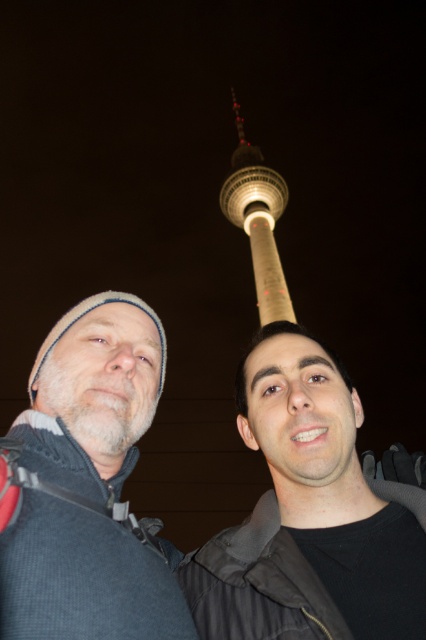
You are trying to identify the clothing items worn by the person on the left in the image. Which item is positioned lower on their head, the dark gray knit hat at upper left or the gray knit beanie at left?

The dark gray knit hat at upper left is positioned below the gray knit beanie at left, meaning it is lower on their head.

You are taking a photo of the dark gray knit hat at upper left and the white concrete tower at upper center. Which object is larger in the photo?

The white concrete tower at upper center is larger than the dark gray knit hat at upper left in the photo.

Where is the dark gray knit hat at upper left located in the image?

The dark gray knit hat at upper left is located at point (252, 531) in the image.